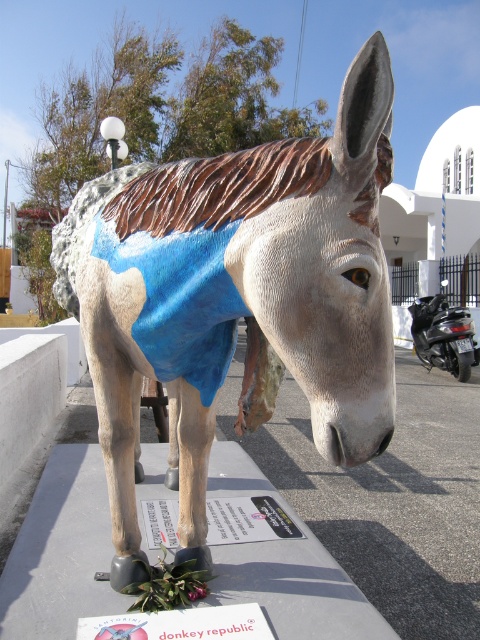
Which is above, matte blue fabric donkey at center or shiny black scooter at right?

matte blue fabric donkey at center is above.

Can you confirm if matte blue fabric donkey at center is taller than shiny black scooter at right?

Indeed, matte blue fabric donkey at center has a greater height compared to shiny black scooter at right.

Locate an element on the screen. Image resolution: width=480 pixels, height=640 pixels. matte blue fabric donkey at center is located at coordinates (238, 298).